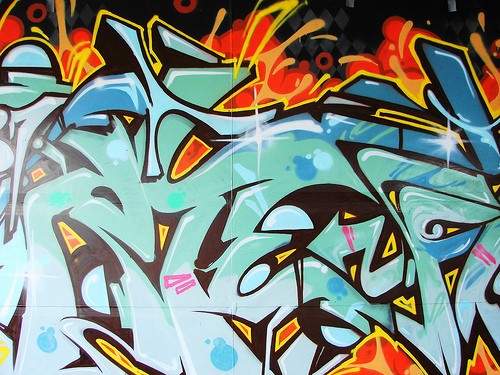
I want to click on paint, so click(x=268, y=128).